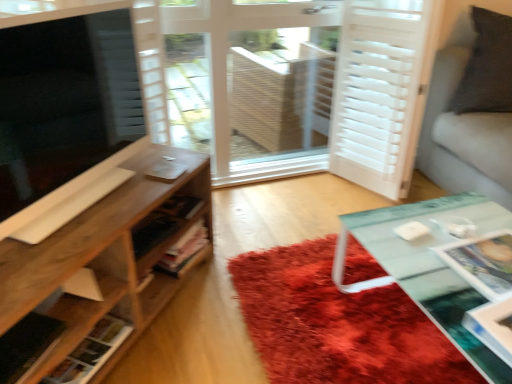
The image size is (512, 384). I want to click on vacant area situated below matte black tv at left (from a real-world perspective), so click(72, 201).